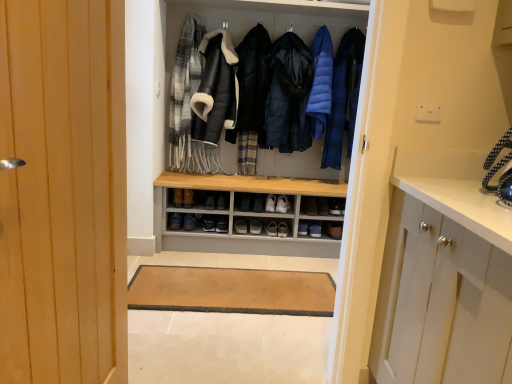
This screenshot has height=384, width=512. What do you see at coordinates (215, 89) in the screenshot? I see `leather jacket at center, which is the second garment in right-to-left order` at bounding box center [215, 89].

Find the location of a particular element. The image size is (512, 384). plaid wool scarf at upper left is located at coordinates (188, 106).

Measure the distance between point (337, 223) and camera.

The depth of point (337, 223) is 3.18 meters.

Measure the distance between point (334,256) and camera.

They are 10.22 feet apart.

This screenshot has width=512, height=384. What do you see at coordinates (258, 203) in the screenshot? I see `black leather shoe at center, arranged as the second shoe when viewed from the right` at bounding box center [258, 203].

What do you see at coordinates (240, 225) in the screenshot? This screenshot has width=512, height=384. I see `black leather shoe at center, the 3th footwear from the left` at bounding box center [240, 225].

The height and width of the screenshot is (384, 512). What do you see at coordinates (336, 206) in the screenshot?
I see `black leather shoe at center, which appears as the 1th shoe when viewed from the right` at bounding box center [336, 206].

Find the location of `leather jacket at center, which is the 1th garment in left-to-right order`. leather jacket at center, which is the 1th garment in left-to-right order is located at coordinates (215, 89).

Identify the location of the 2nd jacket below when counting from the plaid wool scarf at upper left (from the image's perspective). (252, 83).

Which is nearer, (207, 144) or (251, 79)?

Point (207, 144).

From a real-world perspective, is plaid wool scarf at upper left located higher than black quilted jacket at center, the 1th jacket positioned from the left?

Yes, from a real-world perspective, plaid wool scarf at upper left is above black quilted jacket at center, the 1th jacket positioned from the left.

Is plaid wool scarf at upper left wider than black quilted jacket at center, the 1th jacket positioned from the left?

No.

From the image's perspective, which object appears higher, blue down jacket at center or black leather shoe at center, the third shoe in the left-to-right sequence?

blue down jacket at center.

Does blue down jacket at center have a lesser width compared to black leather shoe at center, arranged as the second shoe when viewed from the right?

No, blue down jacket at center is not thinner than black leather shoe at center, arranged as the second shoe when viewed from the right.

Consider the image. Is blue down jacket at center not within black leather shoe at center, arranged as the second shoe when viewed from the right?

blue down jacket at center lies outside black leather shoe at center, arranged as the second shoe when viewed from the right,'s area.

Is blue down jacket at center positioned with its back to black leather shoe at center, arranged as the second shoe when viewed from the right?

No, blue down jacket at center's orientation is not away from black leather shoe at center, arranged as the second shoe when viewed from the right.

In terms of size, does blue down jacket at center appear bigger or smaller than matte black shoe at center, arranged as the fourth footwear when viewed from the left?

Clearly, blue down jacket at center is larger in size than matte black shoe at center, arranged as the fourth footwear when viewed from the left.

How far apart are blue down jacket at center and matte black shoe at center, the third footwear when ordered from right to left?

The distance of blue down jacket at center from matte black shoe at center, the third footwear when ordered from right to left, is 3.43 feet.

Which point is more forward, (354, 37) or (260, 233)?

Positioned in front is point (354, 37).

In the scene shown: Is blue down jacket at center taller or shorter than matte black shoe at center, arranged as the fourth footwear when viewed from the left?

Clearly, blue down jacket at center is taller compared to matte black shoe at center, arranged as the fourth footwear when viewed from the left.

Could you tell me if wooden door at left is facing brown leather shoe at center, acting as the sixth footwear starting from the right?

No, wooden door at left is not facing towards brown leather shoe at center, acting as the sixth footwear starting from the right.

In terms of width, does wooden door at left look wider or thinner when compared to brown leather shoe at center, positioned as the first footwear in left-to-right order?

Clearly, wooden door at left has less width compared to brown leather shoe at center, positioned as the first footwear in left-to-right order.

Consider the image. From the image's perspective, which one is positioned lower, wooden door at left or brown leather shoe at center, acting as the sixth footwear starting from the right?

From the image's view, brown leather shoe at center, acting as the sixth footwear starting from the right, is below.

From a real-world perspective, which is physically above, wooden door at left or brown leather shoe at center, positioned as the first footwear in left-to-right order?

wooden door at left, from a real-world perspective.

Is brown leather shoe at center, positioned as the first footwear in left-to-right order, in front of or behind black leather shoe at center, arranged as the second shoe when viewed from the right, in the image?

brown leather shoe at center, positioned as the first footwear in left-to-right order, is behind black leather shoe at center, arranged as the second shoe when viewed from the right.

Which is correct: brown leather shoe at center, positioned as the first footwear in left-to-right order, is inside black leather shoe at center, arranged as the second shoe when viewed from the right, or outside of it?

brown leather shoe at center, positioned as the first footwear in left-to-right order, is spatially situated outside black leather shoe at center, arranged as the second shoe when viewed from the right.

From the picture: Considering the sizes of brown leather shoe at center, acting as the sixth footwear starting from the right, and black leather shoe at center, arranged as the second shoe when viewed from the right, in the image, is brown leather shoe at center, acting as the sixth footwear starting from the right, taller or shorter than black leather shoe at center, arranged as the second shoe when viewed from the right,?

brown leather shoe at center, acting as the sixth footwear starting from the right, is shorter than black leather shoe at center, arranged as the second shoe when viewed from the right.

Is dark blue puffer jacket at center, which is the first jacket in right-to-left order, behind brown leather shoe at center, positioned as the second shoe in left-to-right order?

No, dark blue puffer jacket at center, which is the first jacket in right-to-left order, is closer to the camera.

Based on the photo, which of these two, dark blue puffer jacket at center, which is the first jacket in right-to-left order, or brown leather shoe at center, which is counted as the third shoe, starting from the right, is bigger?

dark blue puffer jacket at center, which is the first jacket in right-to-left order, is bigger.

From a real-world perspective, is dark blue puffer jacket at center, which ranks as the second jacket in left-to-right order, below brown leather shoe at center, positioned as the second shoe in left-to-right order?

Actually, dark blue puffer jacket at center, which ranks as the second jacket in left-to-right order, is physically above brown leather shoe at center, positioned as the second shoe in left-to-right order, in the real world.

Is brown leather shoe at center, positioned as the second shoe in left-to-right order, located within dark blue puffer jacket at center, which is the first jacket in right-to-left order?

No, brown leather shoe at center, positioned as the second shoe in left-to-right order, is located outside of dark blue puffer jacket at center, which is the first jacket in right-to-left order.

From the image's perspective, is black leather shoe at center, the 3th footwear from the left, above or below black quilted jacket at center, the 1th jacket positioned from the left?

black leather shoe at center, the 3th footwear from the left, is below black quilted jacket at center, the 1th jacket positioned from the left.

Is black leather shoe at center, arranged as the fourth footwear when viewed from the right, taller or shorter than black quilted jacket at center, the 2th jacket positioned from the right?

Clearly, black leather shoe at center, arranged as the fourth footwear when viewed from the right, is shorter compared to black quilted jacket at center, the 2th jacket positioned from the right.

From a real-world perspective, is black leather shoe at center, the 3th footwear from the left, positioned above or below black quilted jacket at center, the 2th jacket positioned from the right?

black leather shoe at center, the 3th footwear from the left, is below black quilted jacket at center, the 2th jacket positioned from the right.

In the image, there is a plaid wool scarf at upper left. What are the coordinates of `jacket below it (from a real-world perspective)` in the screenshot? It's located at (252, 83).

From the image's perspective, starting from the blue down jacket at center, which shoe is the 3rd one below? Please provide its 2D coordinates.

[(258, 203)]

From the image, which object appears to be nearer to dark brown leather shoe at center, acting as the 5th footwear starting from the right, brown leather shoe at center, positioned as the second shoe in left-to-right order, or matte black shoe at center, the third footwear when ordered from right to left?

brown leather shoe at center, positioned as the second shoe in left-to-right order, lies closer to dark brown leather shoe at center, acting as the 5th footwear starting from the right, than the other object.

When comparing their distances from wooden door at left, does brown leather shoe at center, which is counted as the third shoe, starting from the right, or plaid wool scarf at upper left seem closer?

plaid wool scarf at upper left is positioned closer to the anchor wooden door at left.

From the image, which object appears to be nearer to wooden shelf at center, dark brown leather shoe at center, which is the 2th footwear from left to right, or black leather shoe at center, arranged as the fourth footwear when viewed from the right?

Based on the image, black leather shoe at center, arranged as the fourth footwear when viewed from the right, appears to be nearer to wooden shelf at center.

Based on their spatial positions, is dark brown leather shoe at center, acting as the 5th footwear starting from the right, or black leather shoe at center, arranged as the second shoe when viewed from the right, further from brown leather shoe at center, acting as the fourth shoe starting from the right?

Based on the image, black leather shoe at center, arranged as the second shoe when viewed from the right, appears to be further to brown leather shoe at center, acting as the fourth shoe starting from the right.

When comparing their distances from plaid wool scarf at upper left, does brown leather shoe at center, acting as the fourth shoe starting from the right, or matte black shoe at center, the third footwear when ordered from right to left, seem further?

Among the two, matte black shoe at center, the third footwear when ordered from right to left, is located further to plaid wool scarf at upper left.

Which object lies nearer to the anchor point black leather shoe at center, the 3th footwear from the left, black leather shoe at center, the third shoe in the left-to-right sequence, or wooden shelf at center?

black leather shoe at center, the third shoe in the left-to-right sequence, lies closer to black leather shoe at center, the 3th footwear from the left, than the other object.

Estimate the real-world distances between objects in this image. Which object is closer to blue down jacket at center, black leather shoe at center, arranged as the fourth footwear when viewed from the right, or matte black shoe at center, the third footwear when ordered from right to left?

Among the two, matte black shoe at center, the third footwear when ordered from right to left, is located nearer to blue down jacket at center.

Based on their spatial positions, is wooden door at left or dark blue puffer jacket at center, which is the first jacket in right-to-left order, further from brown leather shoe at center, which is counted as the third shoe, starting from the right?

wooden door at left.

Locate an element on the screen. jacket situated between brown leather shoe at center, acting as the fourth shoe starting from the right, and dark blue puffer jacket at center, which ranks as the second jacket in left-to-right order, from left to right is located at coordinates (252, 83).

Locate an element on the screen. This screenshot has width=512, height=384. footwear between wooden door at left and brown leather shoe at center, positioned as the first footwear in left-to-right order, in the front-back direction is located at coordinates pos(282,204).

What are the coordinates of `shelf between brown leather shoe at center, positioned as the first footwear in left-to-right order, and black leather shoe at center, the sixth footwear viewed from the left, from left to right` in the screenshot? It's located at (262, 19).

Where is `clothing between blue down jacket at center, marked as the 1th garment in a right-to-left arrangement, and black leather shoe at center, arranged as the second shoe when viewed from the right, vertically`? clothing between blue down jacket at center, marked as the 1th garment in a right-to-left arrangement, and black leather shoe at center, arranged as the second shoe when viewed from the right, vertically is located at coordinates (344, 98).